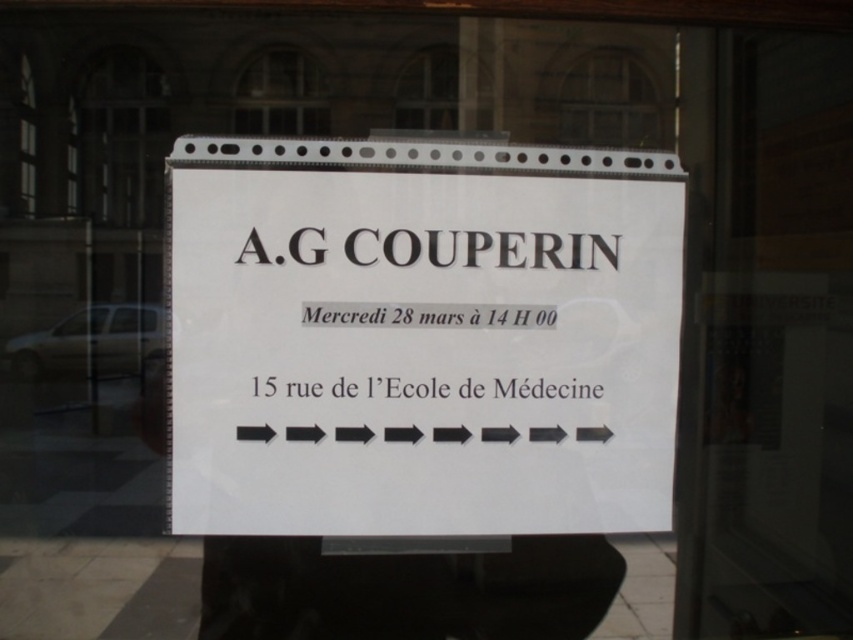
Question: Is transparent glass door at center further to the viewer compared to clear glass window at upper center?

Choices:
 (A) yes
 (B) no

Answer: (A)

Question: Estimate the real-world distances between objects in this image. Which object is farther from the white paper sign at center?

Choices:
 (A) clear glass window at upper center
 (B) transparent glass door at center

Answer: (B)

Question: Which point appears farthest from the camera in this image?

Choices:
 (A) (242, 72)
 (B) (721, 376)

Answer: (B)

Question: Can you confirm if white paper sign at center is thinner than transparent glass door at center?

Choices:
 (A) no
 (B) yes

Answer: (A)

Question: Estimate the real-world distances between objects in this image. Which object is farther from the clear glass window at upper center?

Choices:
 (A) transparent glass door at center
 (B) white paper sign at center

Answer: (A)

Question: Can you confirm if transparent glass door at center is positioned to the right of clear glass window at upper center?

Choices:
 (A) no
 (B) yes

Answer: (B)